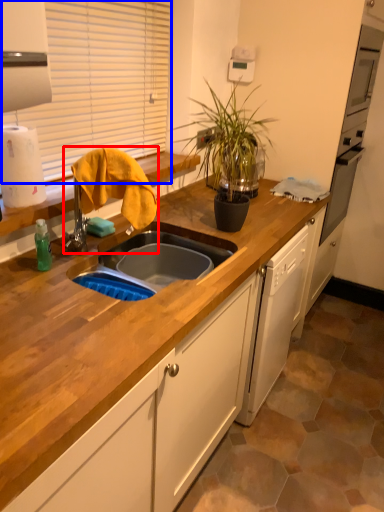
Question: Which object appears closest to the camera in this image, faucet (highlighted by a red box) or window screen (highlighted by a blue box)?

Choices:
 (A) faucet
 (B) window screen

Answer: (A)